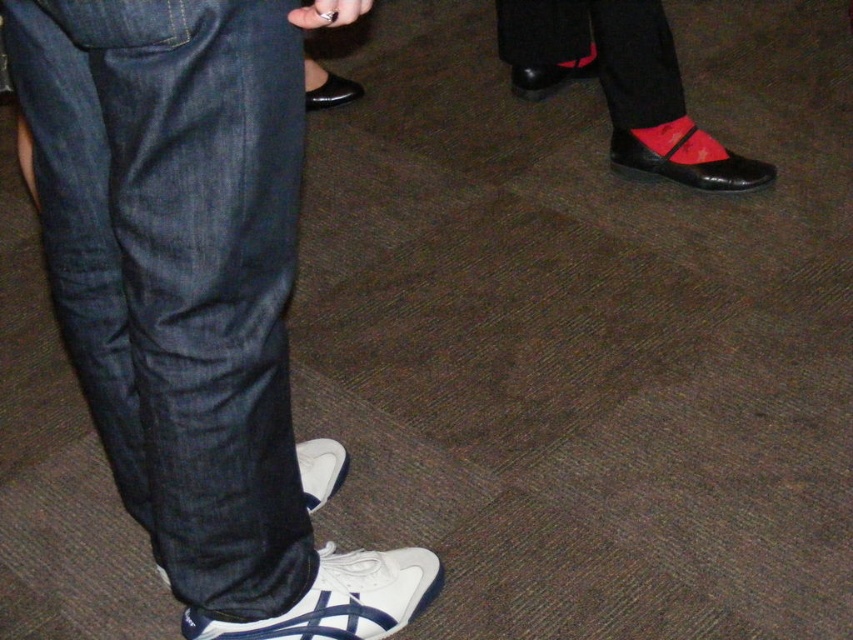
Question: Among these objects, which one is farthest from the camera?

Choices:
 (A) shiny black shoe at upper right
 (B) white synthetic sneaker at lower center
 (C) white synthetic shoe at lower left

Answer: (A)

Question: Is matte black shoe at right wider than shiny black shoe at center?

Choices:
 (A) no
 (B) yes

Answer: (B)

Question: Can you confirm if red satin sock at right is wider than black patent leather shoe at upper right?

Choices:
 (A) no
 (B) yes

Answer: (A)

Question: Estimate the real-world distances between objects in this image. Which object is closer to the red satin sock at right?

Choices:
 (A) shiny black shoe at center
 (B) denim at left
 (C) white synthetic shoe at lower left
 (D) white synthetic sneaker at lower left

Answer: (A)

Question: Which of the following is the farthest from the observer?

Choices:
 (A) (535, 20)
 (B) (310, 449)
 (C) (349, 93)
 (D) (750, 173)

Answer: (C)

Question: Can you confirm if matte black shoe at right is positioned to the left of shiny black shoe at center?

Choices:
 (A) yes
 (B) no

Answer: (B)